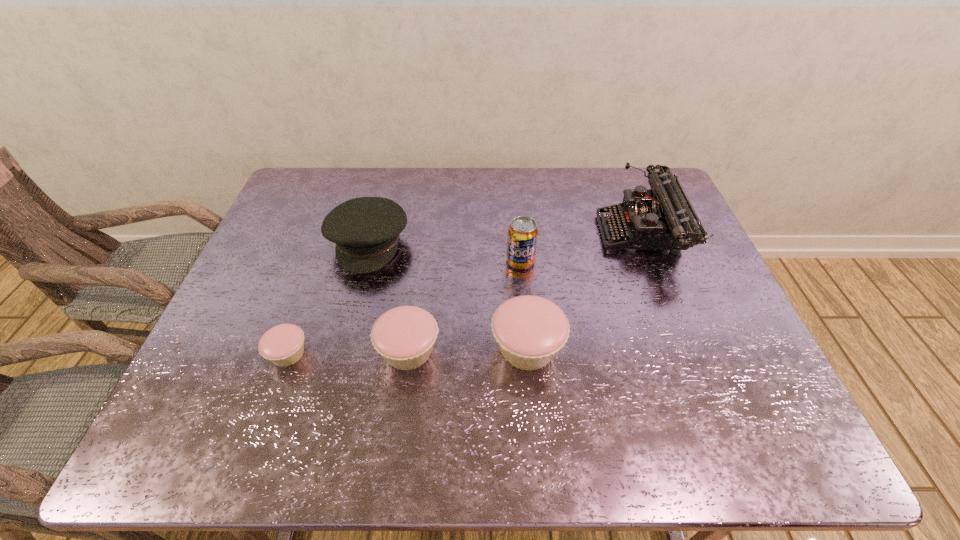
Find the location of a particular element. the shortest cupcake is located at coordinates (283, 345).

The width and height of the screenshot is (960, 540). In order to click on the shortest object in this screenshot , I will do `click(283, 345)`.

Find the location of `the second cupcake from left to right`. the second cupcake from left to right is located at coordinates (404, 336).

Find the location of a particular element. Image resolution: width=960 pixels, height=540 pixels. the fifth tallest object is located at coordinates (404, 336).

Locate an element on the screen. The width and height of the screenshot is (960, 540). the rightmost cupcake is located at coordinates (530, 330).

What are the coordinates of `beret` in the screenshot? It's located at (366, 230).

Locate an element on the screen. The image size is (960, 540). typewriter is located at coordinates (662, 218).

Where is `soda can`? Image resolution: width=960 pixels, height=540 pixels. soda can is located at coordinates (522, 237).

You are a GUI agent. You are given a task and a screenshot of the screen. Output one action in this format:
    pyautogui.click(x=<x>, y=<y>)
    Task: Click on the blank space located 0.120m on the right of the leftmost cupcake
    The width and height of the screenshot is (960, 540).
    Given the screenshot: What is the action you would take?
    pyautogui.click(x=361, y=354)

Where is `vacant space located 0.320m on the right of the fifth tallest object`? vacant space located 0.320m on the right of the fifth tallest object is located at coordinates (577, 350).